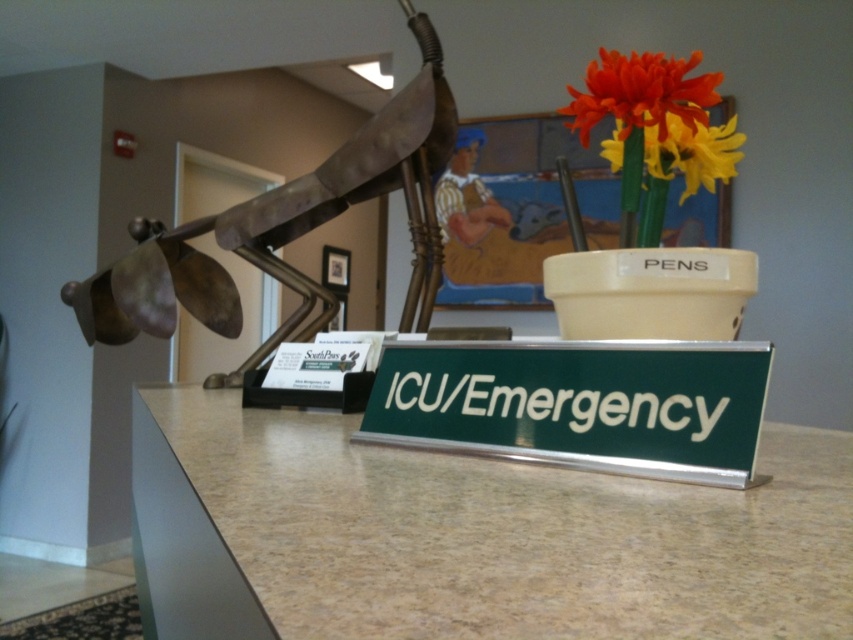
Question: Which object appears farthest from the camera in this image?

Choices:
 (A) white matte vase at center
 (B) metallic sculpture at center
 (C) green metallic sign at center

Answer: (B)

Question: Does white matte vase at center lie behind orange matte flower at upper right?

Choices:
 (A) no
 (B) yes

Answer: (A)

Question: Is metallic sculpture at center to the left of orange matte flower at upper right from the viewer's perspective?

Choices:
 (A) no
 (B) yes

Answer: (B)

Question: Among these points, which one is farthest from the camera?

Choices:
 (A) (683, 497)
 (B) (650, 330)
 (C) (677, 112)
 (D) (648, 154)

Answer: (D)

Question: Is green metallic sign at center positioned at the back of vibrant plastic flowers at upper right?

Choices:
 (A) yes
 (B) no

Answer: (B)

Question: Which point is closer to the camera taking this photo?

Choices:
 (A) (260, 220)
 (B) (512, 493)
 (C) (384, 355)

Answer: (B)